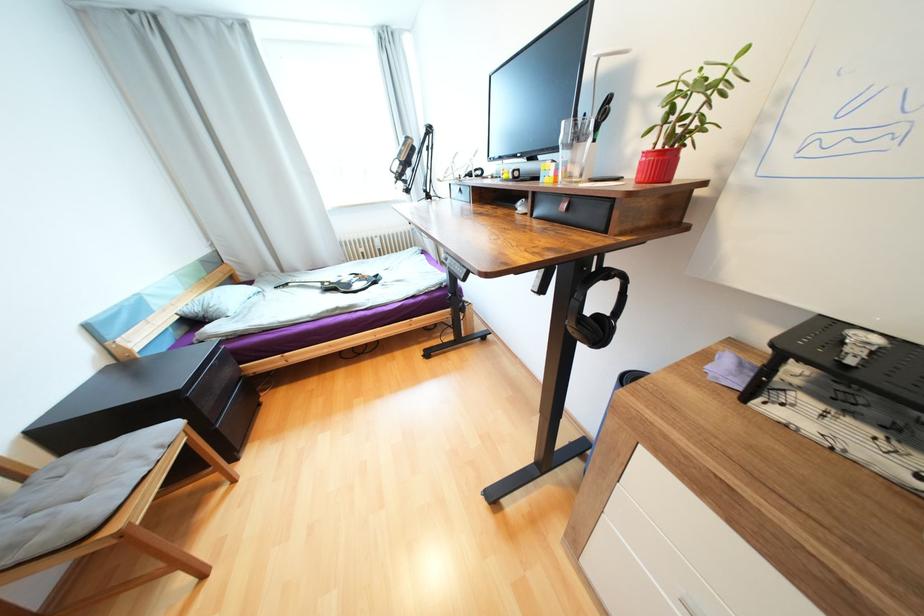
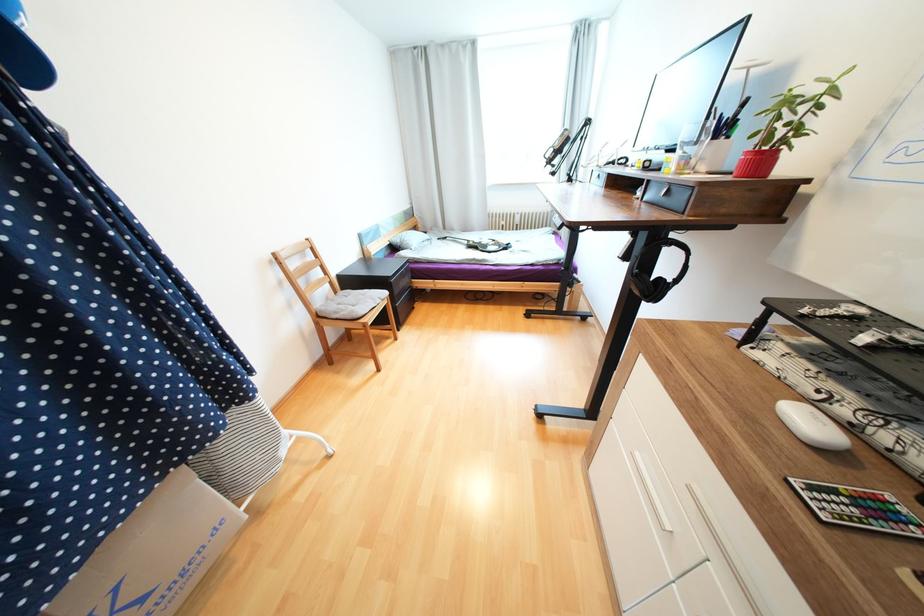
The point at (325, 285) is marked in the first image. Where is the corresponding point in the second image?

(471, 243)